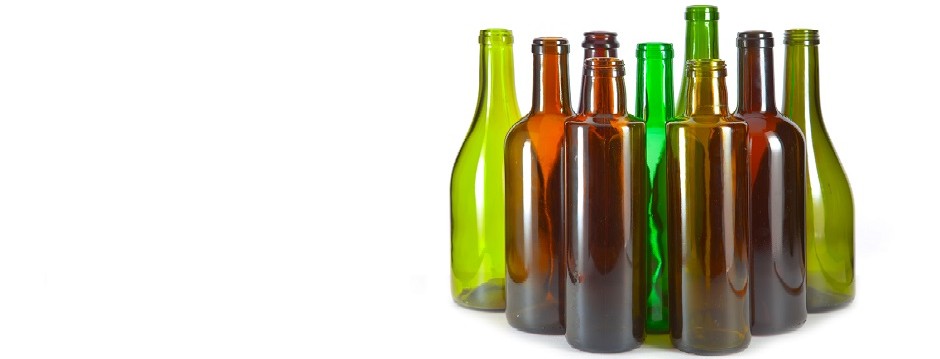
Locate an element on the screen. This screenshot has width=940, height=359. glass bottle is located at coordinates (461, 207), (533, 192), (588, 179), (593, 46), (650, 94), (699, 46), (692, 160), (756, 84), (794, 103).